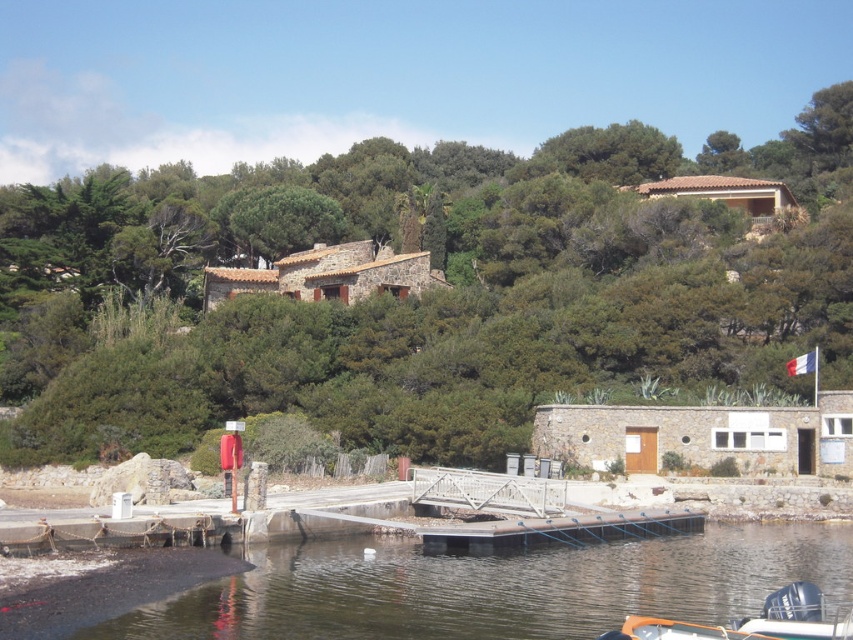
Is point (380, 600) in front of point (770, 596)?

That is False.

Between point (380, 557) and point (809, 586), which one is positioned in front?

Point (809, 586) is more forward.

Where is `clear water at lower center`? The width and height of the screenshot is (853, 640). clear water at lower center is located at coordinates (495, 588).